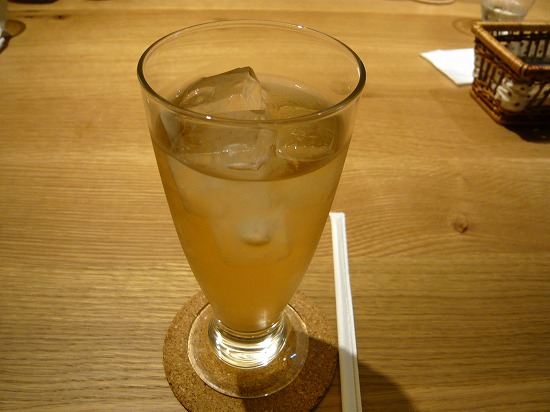
Where is `glass`? glass is located at coordinates (263, 228).